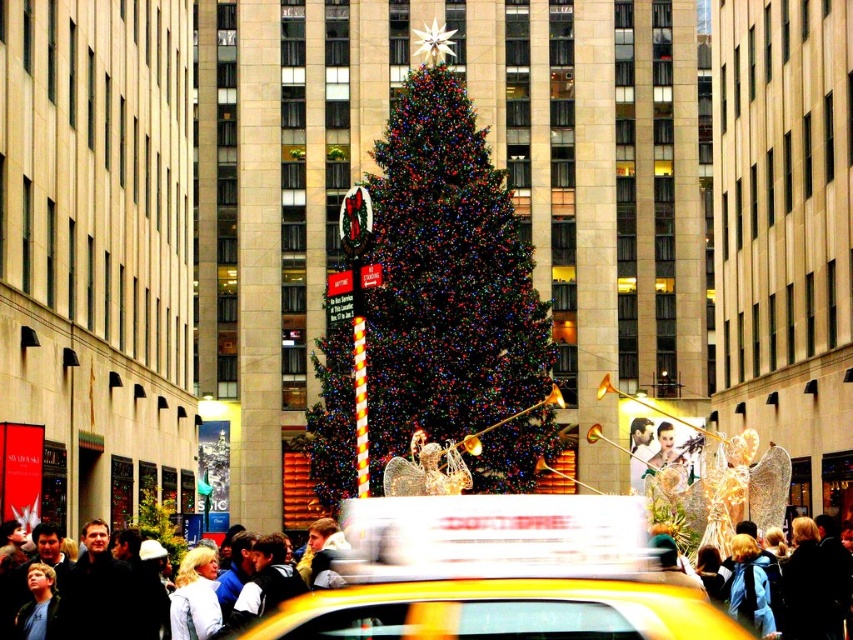
Is point (461, 538) positioned after point (334, 577)?

No, it is in front of (334, 577).

In the scene shown: Can you confirm if yellow plastic taxi at center is positioned below light blue denim jacket at lower left?

No.

Does point (424, 556) come behind point (270, 595)?

No.

Find the location of a particular element. yellow plastic taxi at center is located at coordinates (497, 573).

Who is lower down, green matte christmas tree at center or light blue denim jacket at lower left?

light blue denim jacket at lower left is below.

Is point (466, 490) behind point (213, 637)?

Yes.

The image size is (853, 640). What are the coordinates of `green matte christmas tree at center` in the screenshot? It's located at (433, 314).

Measure the distance between green matte christmas tree at center and yellow plastic taxi at center.

43.48 meters

Who is more distant from viewer, (460, 404) or (344, 577)?

The point (460, 404) is more distant.

Where is `green matte christmas tree at center`? green matte christmas tree at center is located at coordinates (433, 314).